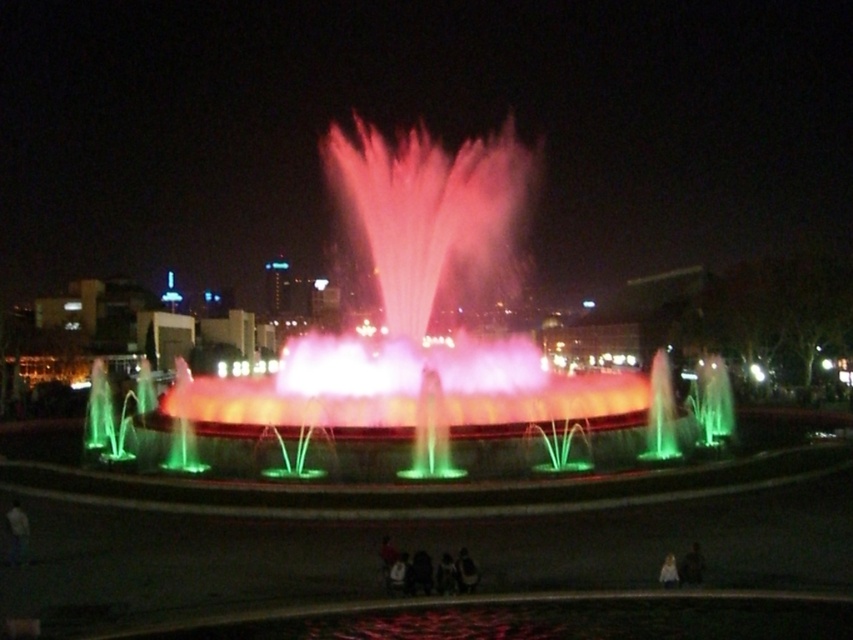
You are standing in the nighttime scene and want to take a photo of the illuminated water at center without any obstructions. Is the light brown leather jacket at lower right blocking your view?

A: The light brown leather jacket at lower right is behind the illuminated water at center, so it will not block your view of the illuminated water at center.